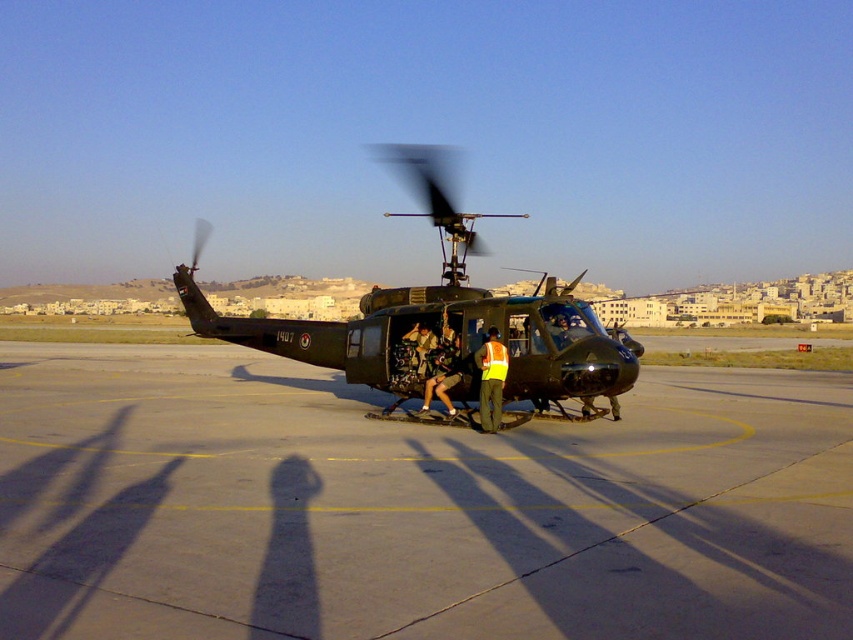
Question: Considering the real-world distances, which object is farthest from the concrete tarmac at center?

Choices:
 (A) reflective orange vest at center
 (B) camouflage fabric uniform at center

Answer: (A)

Question: Does concrete tarmac at center appear under reflective orange vest at center?

Choices:
 (A) yes
 (B) no

Answer: (A)

Question: Which object appears farthest from the camera in this image?

Choices:
 (A) matte black helicopter at center
 (B) concrete tarmac at center
 (C) reflective orange vest at center

Answer: (C)

Question: Does matte black helicopter at center appear under camouflage fabric uniform at center?

Choices:
 (A) yes
 (B) no

Answer: (B)

Question: Which point is closer to the camera?

Choices:
 (A) concrete tarmac at center
 (B) matte black helicopter at center

Answer: (A)

Question: Is matte black helicopter at center smaller than camouflage fabric uniform at center?

Choices:
 (A) yes
 (B) no

Answer: (B)